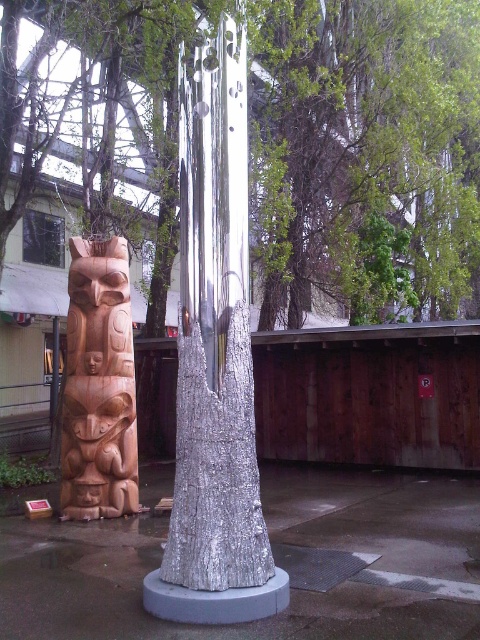
You are standing 2 meters away from the camera. Can you see the shiny metallic tree trunk at center clearly?

Since the shiny metallic tree trunk at center is 4.28 meters away from the camera, and you are standing 2 meters away from the camera, you are 6.28 meters away from the shiny metallic tree trunk at center. Therefore, you can see it clearly as it is a large sculpture.

You are an artist planning to photograph both the shiny metallic tree trunk at center and the wooden totem pole at left. If you want to ensure both are fully visible in the frame without cropping, which sculpture should you position closer to the camera?

Since the shiny metallic tree trunk at center is narrower than the wooden totem pole at left, you should position the wooden totem pole at left closer to the camera to ensure both fit within the frame without cropping.